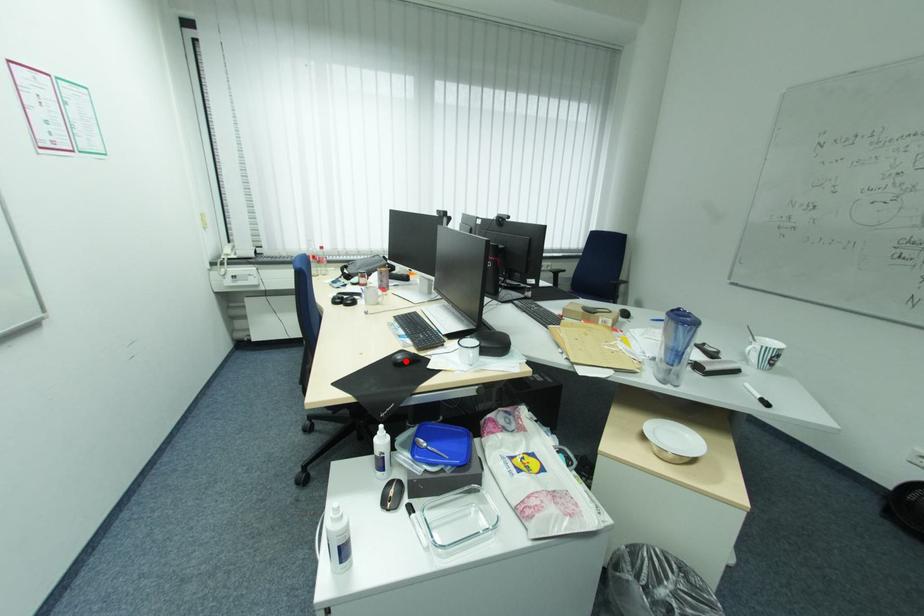
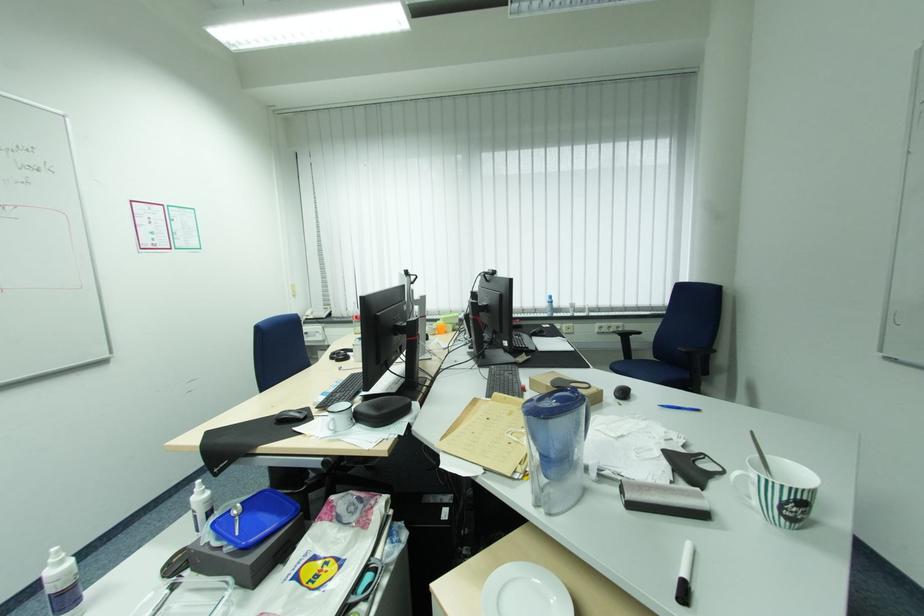
In the second image, find the point that corresponds to the highlighted location in the first image.

(286, 418)